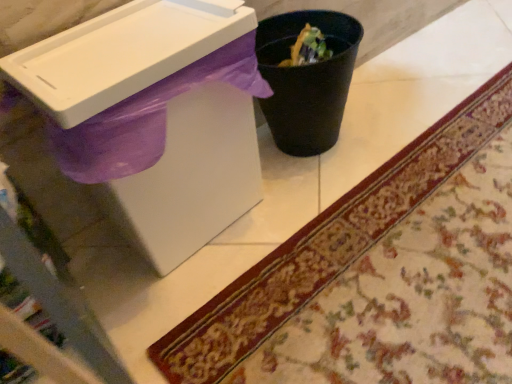
Measure the distance between white plastic sink at upper left and camera.

A distance of 22.85 inches exists between white plastic sink at upper left and camera.

Where is `carpeted mat at lower right`? This screenshot has width=512, height=384. carpeted mat at lower right is located at coordinates click(x=379, y=274).

Measure the distance between black plastic trash can at center and camera.

black plastic trash can at center is 32.09 inches from camera.

Where is `black plastic trash can at center`? black plastic trash can at center is located at coordinates (306, 80).

Locate an element on the screen. white plastic sink at upper left is located at coordinates (148, 117).

From the image's perspective, is white plastic sink at upper left positioned above or below black plastic trash can at center?

Clearly, from the image's perspective, white plastic sink at upper left is below black plastic trash can at center.

Is point (131, 146) positioned after point (333, 56)?

That is False.

Visually, is white plastic sink at upper left positioned to the left or to the right of black plastic trash can at center?

white plastic sink at upper left is to the left of black plastic trash can at center.

From a real-world perspective, is black plastic trash can at center positioned above or below white plastic sink at upper left?

black plastic trash can at center is situated lower than white plastic sink at upper left in the real world.

Where is `waste container below the white plastic sink at upper left (from a real-world perspective)`? The image size is (512, 384). waste container below the white plastic sink at upper left (from a real-world perspective) is located at coordinates (306, 80).

Is black plastic trash can at center looking in the opposite direction of white plastic sink at upper left?

No, black plastic trash can at center's orientation is not away from white plastic sink at upper left.

Considering the sizes of objects black plastic trash can at center and white plastic sink at upper left in the image provided, who is thinner, black plastic trash can at center or white plastic sink at upper left?

Thinner between the two is black plastic trash can at center.

From a real-world perspective, is carpeted mat at lower right positioned under black plastic trash can at center based on gravity?

Correct, in the physical world, carpeted mat at lower right is lower than black plastic trash can at center.

From the picture: Considering the sizes of objects carpeted mat at lower right and black plastic trash can at center in the image provided, who is shorter, carpeted mat at lower right or black plastic trash can at center?

carpeted mat at lower right.

Between carpeted mat at lower right and black plastic trash can at center, which one is positioned behind?

black plastic trash can at center is behind.

Is carpeted mat at lower right facing away from black plastic trash can at center?

No, carpeted mat at lower right is not facing away from black plastic trash can at center.

Which of these two, black plastic trash can at center or carpeted mat at lower right, is thinner?

black plastic trash can at center is thinner.

Is black plastic trash can at center not inside carpeted mat at lower right?

Yes, black plastic trash can at center is not within carpeted mat at lower right.

Between black plastic trash can at center and carpeted mat at lower right, which one has less height?

carpeted mat at lower right.

Does carpeted mat at lower right have a greater height compared to white plastic sink at upper left?

No, carpeted mat at lower right is not taller than white plastic sink at upper left.

What's the angular difference between carpeted mat at lower right and white plastic sink at upper left's facing directions?

They differ by 91.9 degrees in their facing directions.

Is carpeted mat at lower right to the right of white plastic sink at upper left from the viewer's perspective?

Yes.

Could you tell me if carpeted mat at lower right is facing white plastic sink at upper left?

No, carpeted mat at lower right is not facing towards white plastic sink at upper left.

Is white plastic sink at upper left spatially inside carpeted mat at lower right, or outside of it?

white plastic sink at upper left cannot be found inside carpeted mat at lower right.

Between white plastic sink at upper left and carpeted mat at lower right, which one has more height?

With more height is white plastic sink at upper left.

From a real-world perspective, between white plastic sink at upper left and carpeted mat at lower right, who is vertically lower?

carpeted mat at lower right.

Does white plastic sink at upper left appear on the left side of carpeted mat at lower right?

Correct, you'll find white plastic sink at upper left to the left of carpeted mat at lower right.

Find the location of a particular element. Image resolution: width=512 pixels, height=384 pixels. sink to the left of black plastic trash can at center is located at coordinates (148, 117).

You are a GUI agent. You are given a task and a screenshot of the screen. Output one action in this format:
    pyautogui.click(x=<x>, y=<y>)
    Task: Click on the sink below the black plastic trash can at center (from the image's perspective)
    This screenshot has height=384, width=512.
    Given the screenshot: What is the action you would take?
    pyautogui.click(x=148, y=117)

Based on their spatial positions, is white plastic sink at upper left or black plastic trash can at center further from carpeted mat at lower right?

Based on the image, white plastic sink at upper left appears to be further to carpeted mat at lower right.

Looking at the image, which one is located further to carpeted mat at lower right, black plastic trash can at center or white plastic sink at upper left?

white plastic sink at upper left lies further to carpeted mat at lower right than the other object.

Looking at the image, which one is located closer to black plastic trash can at center, carpeted mat at lower right or white plastic sink at upper left?

white plastic sink at upper left is closer to black plastic trash can at center.

Looking at the image, which one is located closer to white plastic sink at upper left, carpeted mat at lower right or black plastic trash can at center?

The object closer to white plastic sink at upper left is black plastic trash can at center.

From the image, which object appears to be nearer to black plastic trash can at center, white plastic sink at upper left or carpeted mat at lower right?

white plastic sink at upper left is positioned closer to the anchor black plastic trash can at center.

Based on their spatial positions, is black plastic trash can at center or carpeted mat at lower right closer to white plastic sink at upper left?

black plastic trash can at center.

The height and width of the screenshot is (384, 512). What are the coordinates of `waste container situated between white plastic sink at upper left and carpeted mat at lower right from left to right` in the screenshot? It's located at (306, 80).